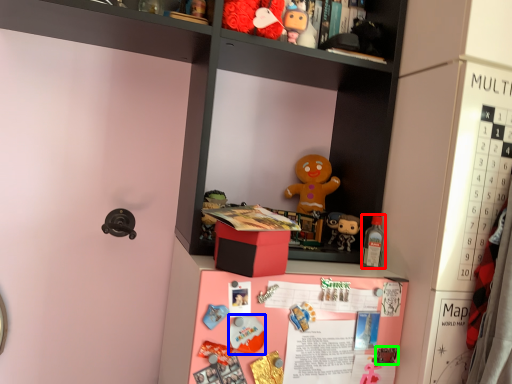
Question: Based on their relative distances, which object is nearer to toy (highlighted by a red box)? Choose from toy (highlighted by a blue box) and toy (highlighted by a green box).

Choices:
 (A) toy
 (B) toy

Answer: (B)